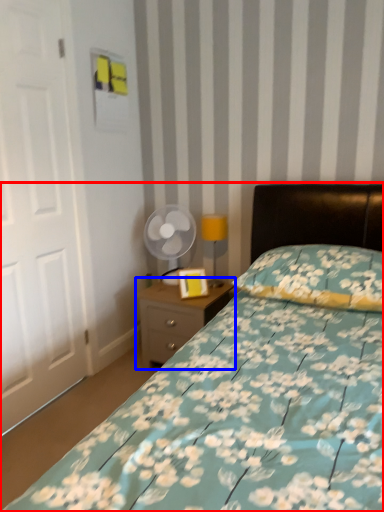
Question: Among these objects, which one is nearest to the camera, bed (highlighted by a red box) or nightstand (highlighted by a blue box)?

Choices:
 (A) bed
 (B) nightstand

Answer: (A)